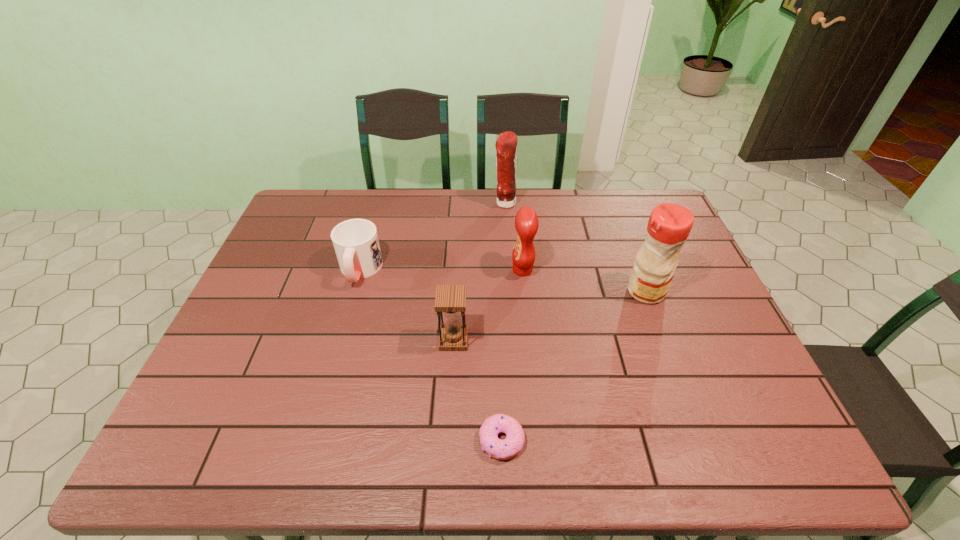
Find the location of a particular element. The image size is (960, 540). the rightmost object is located at coordinates (669, 225).

Find the location of a particular element. The height and width of the screenshot is (540, 960). the farthest object is located at coordinates (506, 145).

The image size is (960, 540). I want to click on the third tallest object, so click(526, 221).

In order to click on hourglass in this screenshot , I will do `click(450, 299)`.

Where is `the second nearest object`? This screenshot has height=540, width=960. the second nearest object is located at coordinates (450, 299).

Identify the location of mug. (356, 244).

In order to click on the leftmost object in this screenshot , I will do `click(356, 244)`.

This screenshot has height=540, width=960. Identify the location of doughnut. (505, 449).

Where is `the nearest object`? The image size is (960, 540). the nearest object is located at coordinates (505, 449).

You are a GUI agent. You are given a task and a screenshot of the screen. Output one action in this format:
    pyautogui.click(x=<x>, y=<y>)
    Task: Click on the vacant space located 0.140m on the back of the rightmost object
    This screenshot has width=960, height=540.
    Given the screenshot: What is the action you would take?
    pyautogui.click(x=629, y=247)